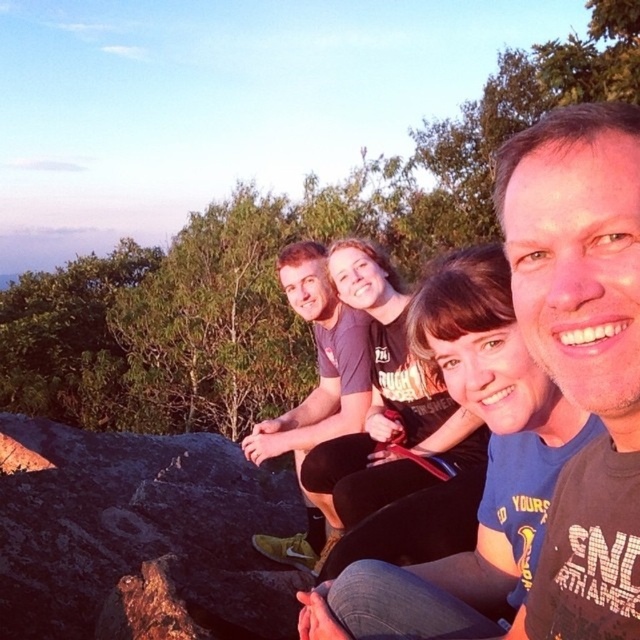
Question: Which of the following is the closest to the observer?

Choices:
 (A) pos(310,419)
 (B) pos(492,387)

Answer: (B)

Question: Does matte brown t-shirt at center have a smaller size compared to matte gray t-shirt at center?

Choices:
 (A) no
 (B) yes

Answer: (B)

Question: Among these points, which one is nearest to the camera?

Choices:
 (A) (496, 252)
 (B) (333, 424)

Answer: (A)

Question: Can you confirm if matte brown t-shirt at center is positioned to the left of dark blue t-shirt at center?

Choices:
 (A) no
 (B) yes

Answer: (B)

Question: In this image, where is dark blue t-shirt at center located relative to matte gray t-shirt at center?

Choices:
 (A) right
 (B) left

Answer: (A)

Question: Which point appears closest to the camera in this image?

Choices:
 (A) (458, 577)
 (B) (518, 180)
 (C) (326, 426)

Answer: (B)